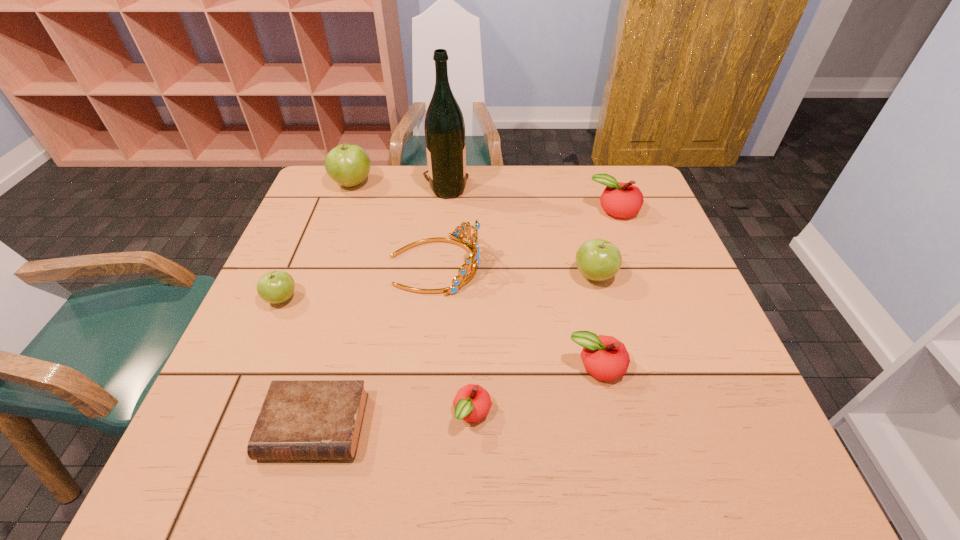
This screenshot has width=960, height=540. In the image, there is a desktop. What are the coordinates of `vacant region at the near edge` in the screenshot? It's located at (564, 465).

You are a GUI agent. You are given a task and a screenshot of the screen. Output one action in this format:
    pyautogui.click(x=<x>, y=<y>)
    Task: Click on the vacant space at the left edge of the desktop
    
    Given the screenshot: What is the action you would take?
    pyautogui.click(x=304, y=340)

What are the coordinates of `free space at the right edge of the desktop` in the screenshot? It's located at (676, 276).

The height and width of the screenshot is (540, 960). In the image, there is a desktop. In order to click on vacant space at the far left corner in this screenshot , I will do `click(324, 197)`.

What are the coordinates of `empty location between the rightmost green apple and the gold tiara` in the screenshot? It's located at (515, 270).

The height and width of the screenshot is (540, 960). I want to click on free area in between the tiara and the shortest object, so click(374, 346).

I want to click on free spot between the farthest green apple and the wine bottle, so click(398, 185).

You are a GUI agent. You are given a task and a screenshot of the screen. Output one action in this format:
    pyautogui.click(x=<x>, y=<y>)
    Task: Click on the free space that is in between the wine bottle and the shortest apple
    This screenshot has width=960, height=540.
    Given the screenshot: What is the action you would take?
    pyautogui.click(x=459, y=300)

The height and width of the screenshot is (540, 960). In order to click on vacant area that lies between the farthest green apple and the smallest green apple in this screenshot , I will do `click(317, 241)`.

Identify the location of free space between the second biggest green apple and the wine bottle. The image size is (960, 540). (519, 232).